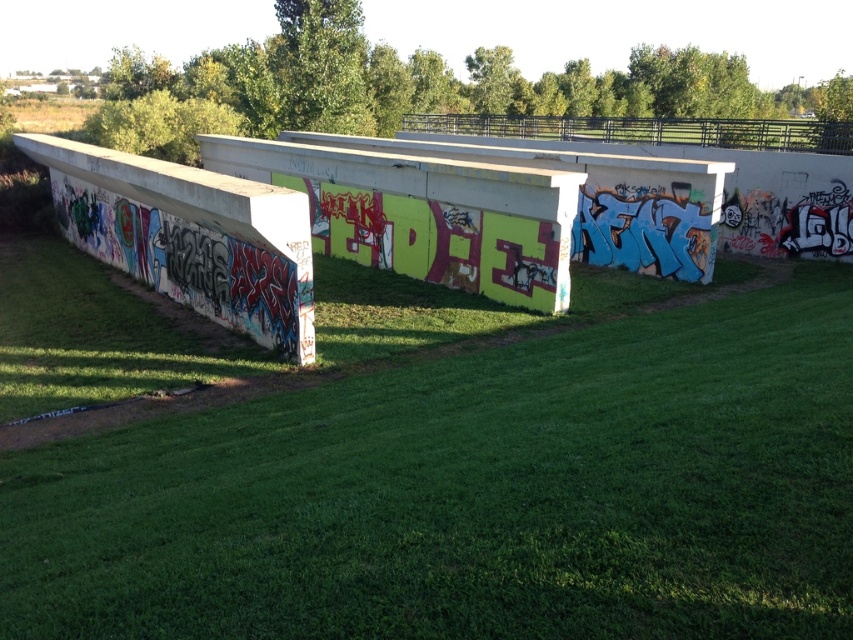
Question: Which of the following is the closest to the observer?

Choices:
 (A) (830, 372)
 (B) (109, 253)

Answer: (A)

Question: Which point is closer to the camera taking this photo?

Choices:
 (A) (712, 573)
 (B) (142, 157)

Answer: (A)

Question: Is green grass at center thinner than concreteroughbridge at left?

Choices:
 (A) no
 (B) yes

Answer: (A)

Question: Can you confirm if green grass at center is positioned below concreteroughbridge at left?

Choices:
 (A) no
 (B) yes

Answer: (B)

Question: Does green grass at center appear on the right side of concreteroughbridge at left?

Choices:
 (A) yes
 (B) no

Answer: (A)

Question: Which of the following is the closest to the observer?

Choices:
 (A) (225, 196)
 (B) (125, 545)

Answer: (B)